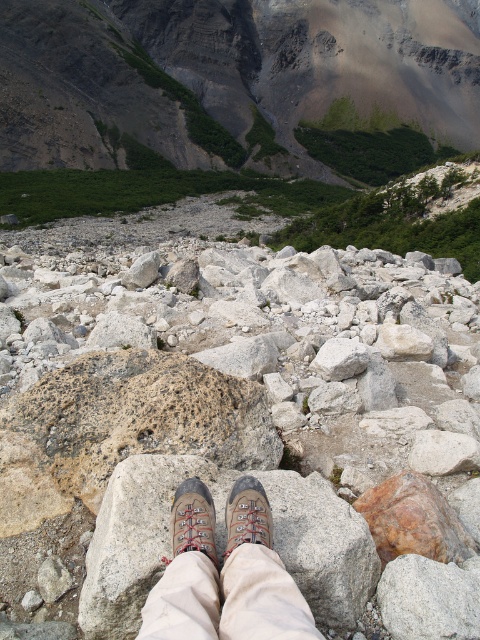
Question: Does rugged granite mountain at upper center have a smaller size compared to brown suede shoe at center?

Choices:
 (A) yes
 (B) no

Answer: (B)

Question: Is speckled rock at center wider than brown suede shoe at center?

Choices:
 (A) no
 (B) yes

Answer: (B)

Question: Which is farther from the rugged granite mountain at upper center?

Choices:
 (A) brown leather boots at center
 (B) speckled rock at center

Answer: (A)

Question: Which point is closer to the camera?

Choices:
 (A) (228, 550)
 (B) (211, 532)

Answer: (A)

Question: Can you confirm if speckled rock at center is positioned to the right of brown suede shoe at center?

Choices:
 (A) no
 (B) yes

Answer: (A)

Question: Which point appears farthest from the camera in this image?

Choices:
 (A) (271, 538)
 (B) (241, 490)
 (C) (193, 538)
 (D) (226, 122)

Answer: (D)